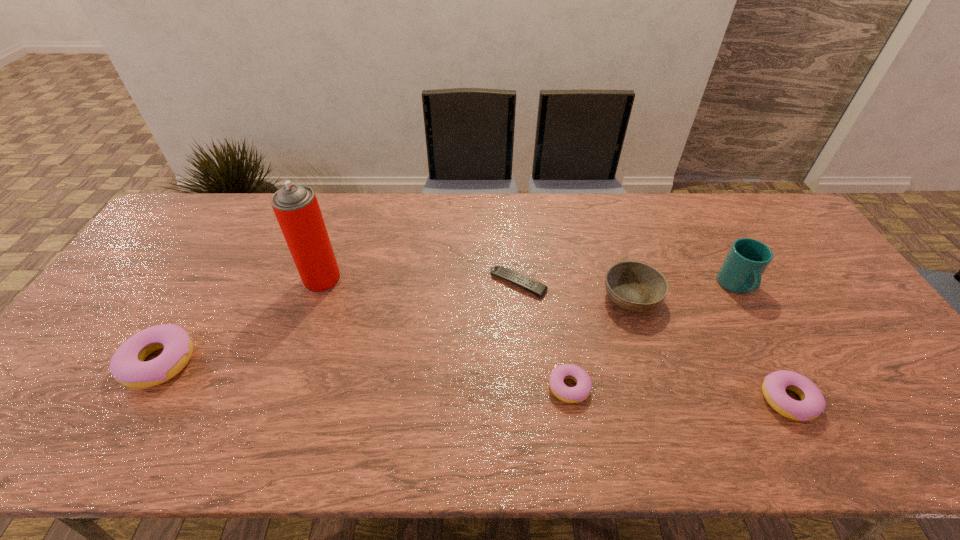
Where is `the sixth object from right to left`? This screenshot has width=960, height=540. the sixth object from right to left is located at coordinates (296, 207).

Locate an element on the screen. free space located 0.080m on the left of the leftmost object is located at coordinates (92, 362).

The width and height of the screenshot is (960, 540). What are the coordinates of `free space located on the left of the sixth tallest object` in the screenshot? It's located at (465, 387).

I want to click on vacant space located on the right of the second tallest doughnut, so click(917, 401).

This screenshot has width=960, height=540. Find the location of `free spot located 0.270m on the handle side of the sixth shortest object`. free spot located 0.270m on the handle side of the sixth shortest object is located at coordinates (794, 390).

In order to click on free spot located on the back of the remote control in this screenshot , I will do `click(511, 193)`.

Find the location of a particular element. The height and width of the screenshot is (540, 960). vacant area located 0.200m on the back of the third object from right to left is located at coordinates click(x=611, y=232).

Where is `vacant space located on the back of the aerosol can`? The height and width of the screenshot is (540, 960). vacant space located on the back of the aerosol can is located at coordinates (331, 253).

This screenshot has width=960, height=540. Identify the location of object located in the left edge section of the desktop. (127, 366).

Locate an element on the screen. object at the near left corner is located at coordinates (127, 366).